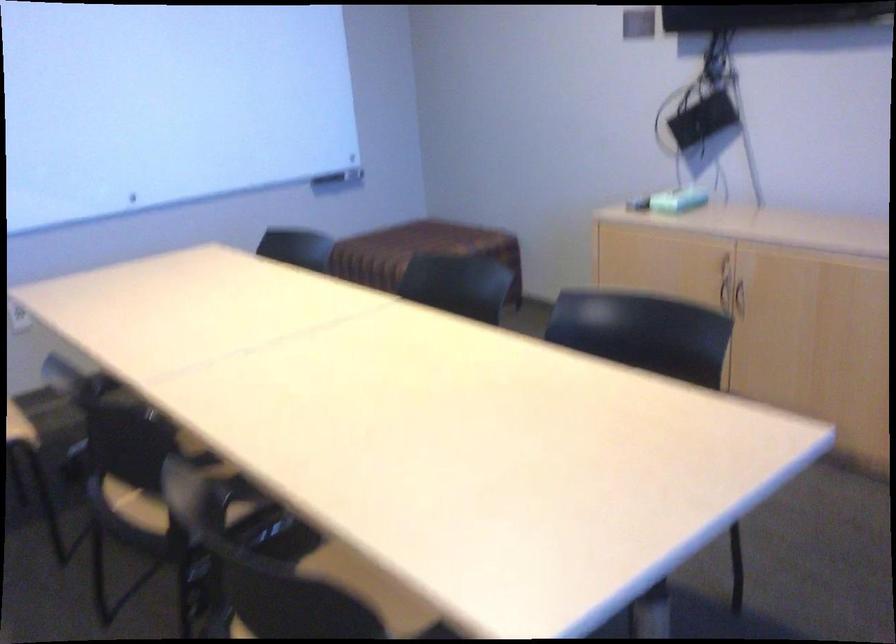
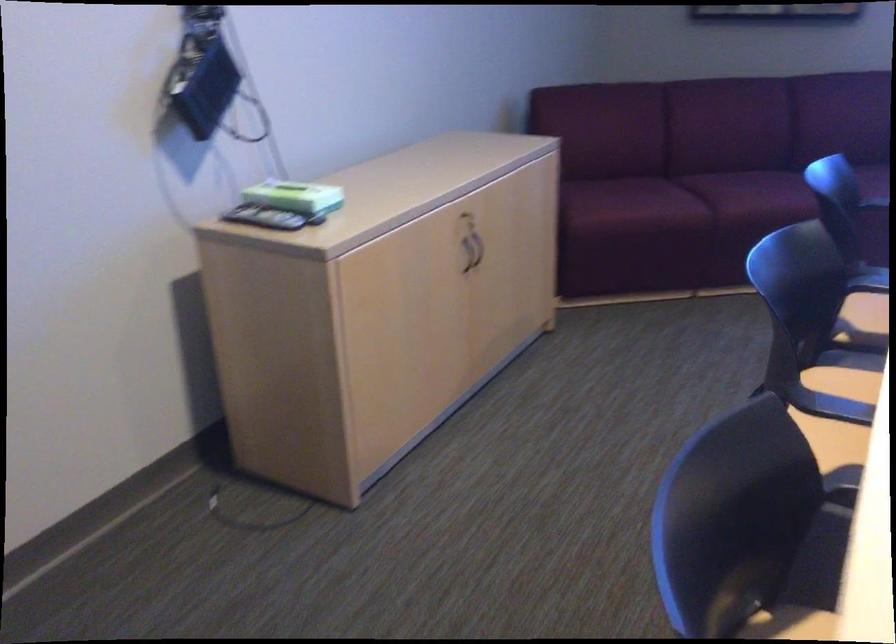
In the second image, find the point that corresponds to (742,297) in the first image.

(464, 259)